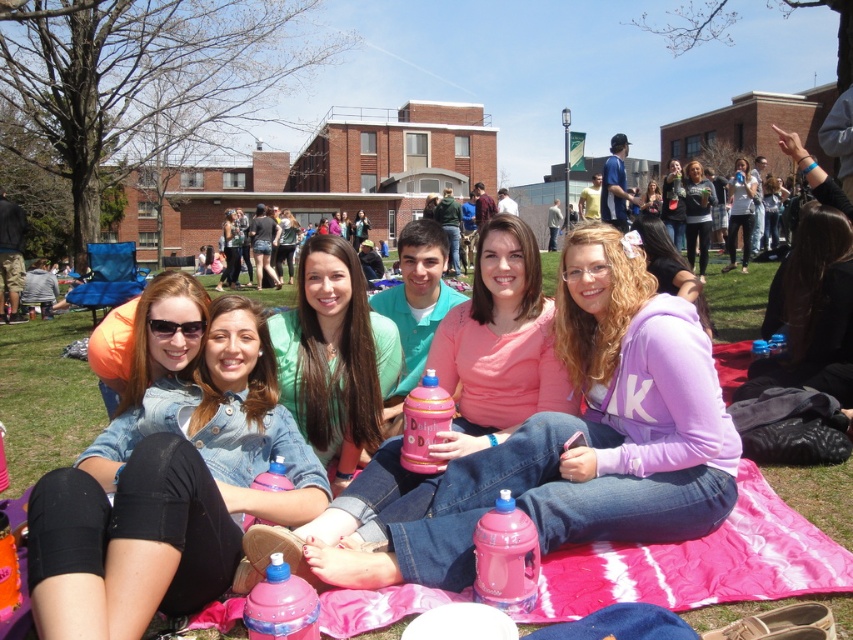
You are standing on the grass looking at the picnic blanket. Which item is closer to you between the denim jacket at center and the green matte shirt at center?

The denim jacket at center is positioned under the green matte shirt at center, so the denim jacket at center is closer to you.

You are standing in the outdoor scene and want to pick up the matte black hoodie at upper right and the matte black jacket at upper right. Which one do you need to reach for first?

The matte black hoodie at upper right is closer to the viewer than the matte black jacket at upper right, so you should reach for the matte black hoodie at upper right first.

You are organizing a clothing donation drive and need to determine if the denim jacket at center and the matte black hoodie at upper right can fit side by side on a shelf that is 1.2 meters wide. Given their widths, can both items fit?

The denim jacket at center has a lesser width compared to matte black hoodie at upper right. If the combined width of both items is less than or equal to 1.2 meters, they can fit. However, without knowing the exact widths, we cannot confirm. But since the denim jacket is narrower, it might be possible if the hoodie is not excessively wide.